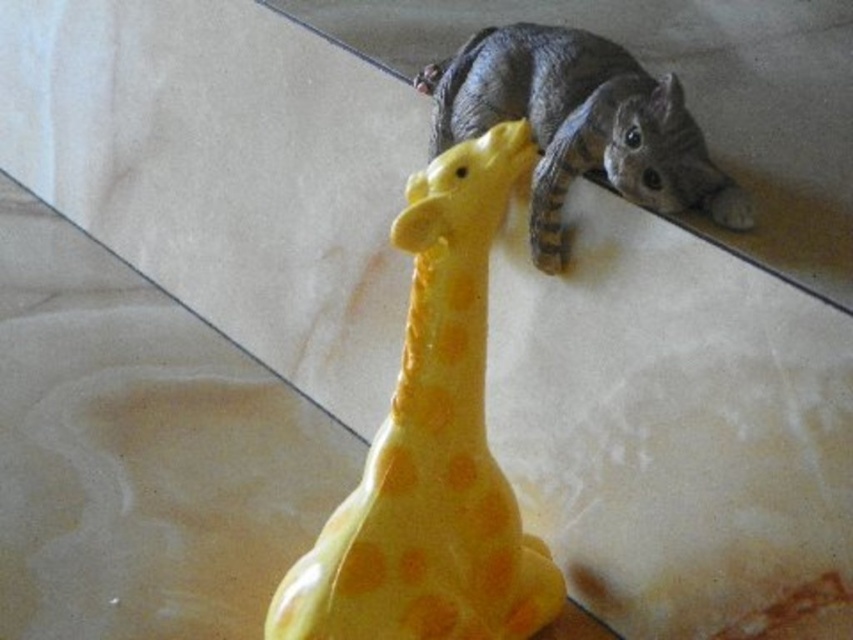
Measure the distance between yellow rubber giraffe at center and camera.

1.18 meters

Locate an element on the screen. Image resolution: width=853 pixels, height=640 pixels. yellow rubber giraffe at center is located at coordinates (432, 449).

I want to click on yellow rubber giraffe at center, so click(432, 449).